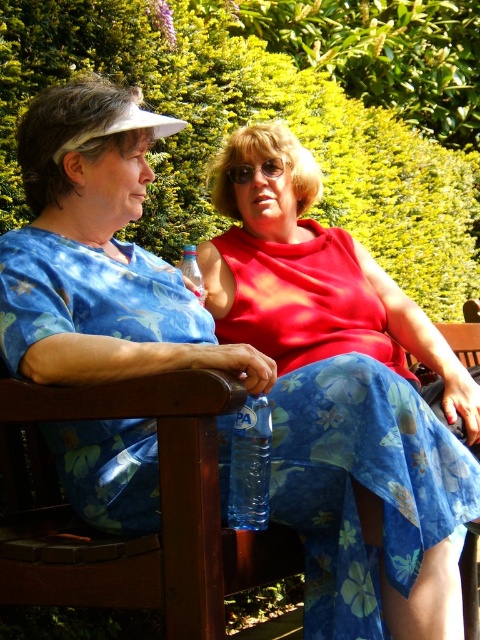
You are a photographer standing in front of the two people on the bench. You want to take a photo focusing on the transparent plastic bottle at center and the clear plastic bottle at center. Which bottle should you adjust your camera focus on first if you want to capture both clearly?

The transparent plastic bottle at center is closer to the viewer than the clear plastic bottle at center, so you should focus on the transparent plastic bottle at center first to ensure both are in focus.

You are a delivery person who needs to place a small package exactly at the point marked by coordinates (250, 465). According to the scene, what object is located at that point?

The point at coordinates (250, 465) corresponds to the transparent plastic bottle at center, so the small package should be placed there.

You are a park ranger who needs to determine which water bottle to refill. Both the transparent plastic bottle at center and the clear plastic bottle at center are on the bench. Which one has a greater capacity based on their height?

The transparent plastic bottle at center is taller than the clear plastic bottle at center, so it likely has a greater capacity.